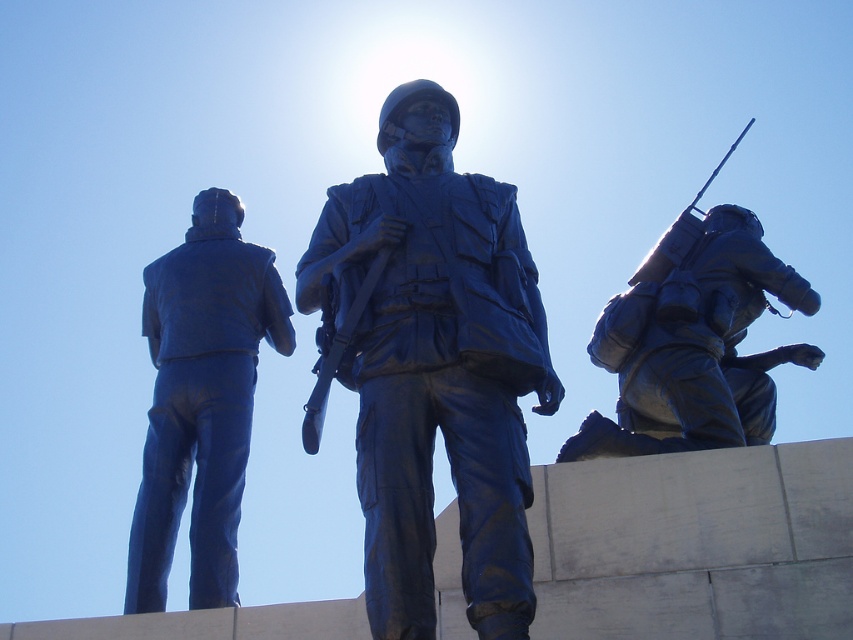
Who is lower down, blue polished statue at left or shiny metallic rifle at center?

blue polished statue at left is below.

Locate an element on the screen. This screenshot has width=853, height=640. blue polished statue at left is located at coordinates (201, 400).

Is point (218, 556) farther from viewer compared to point (299, 289)?

Yes, point (218, 556) is behind point (299, 289).

At what (x,y) coordinates should I click in order to perform the action: click on blue polished statue at left. Please return your answer as a coordinate pair (x, y). Looking at the image, I should click on (201, 400).

Can you confirm if blue polished metal soldier at center is wider than shiny metallic rifle at center?

Yes, blue polished metal soldier at center is wider than shiny metallic rifle at center.

Identify the location of blue polished metal soldier at center. (434, 365).

Does matte blue soldier at right have a greater width compared to shiny metallic rifle at center?

Correct, the width of matte blue soldier at right exceeds that of shiny metallic rifle at center.

Between point (680, 332) and point (326, 385), which one is positioned in front?

Positioned in front is point (326, 385).

Between point (643, 266) and point (306, 291), which one is positioned behind?

Positioned behind is point (643, 266).

I want to click on matte blue soldier at right, so click(x=689, y=337).